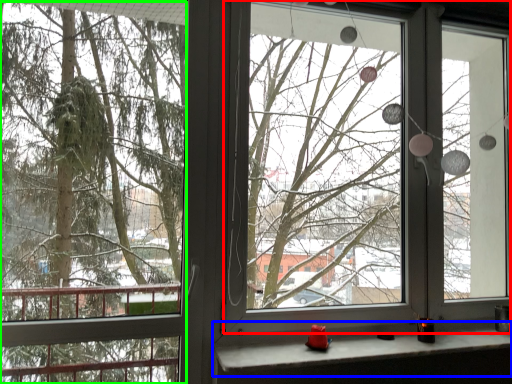
Question: Which is nearer to the window screen (highlighted by a red box)? window sill (highlighted by a blue box) or tree (highlighted by a green box).

Choices:
 (A) window sill
 (B) tree

Answer: (B)